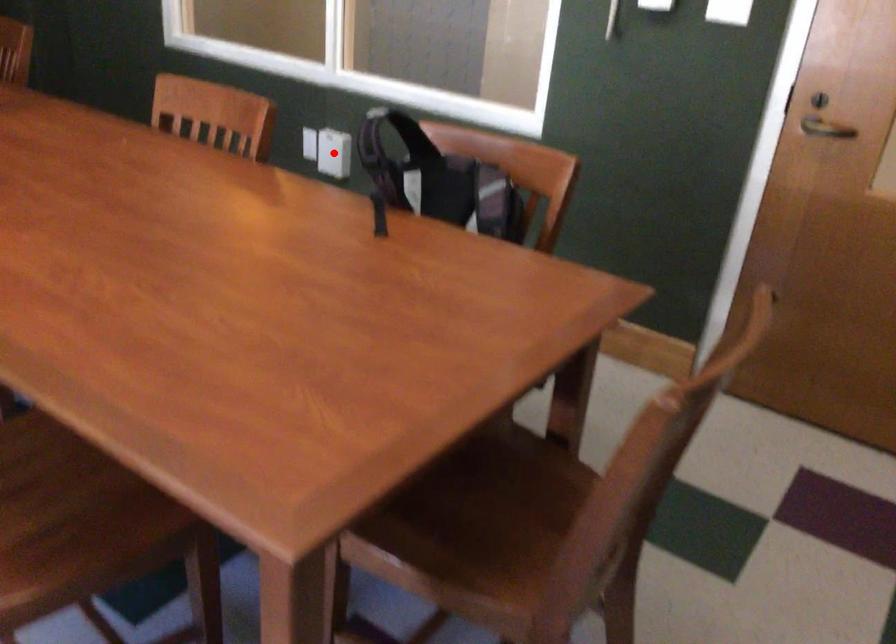
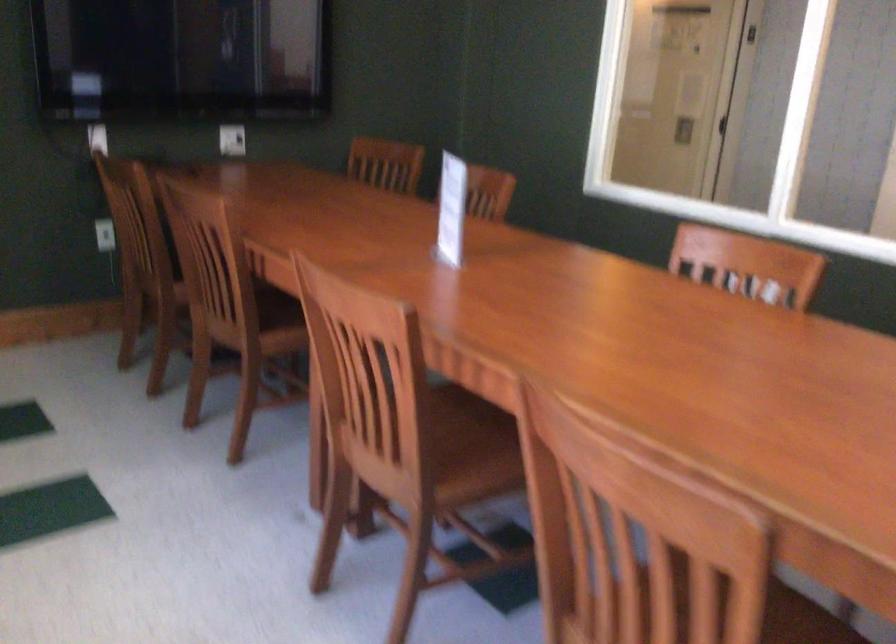
Question: I am providing you with two images of the same scene from different viewpoints. A red point is marked on the first image. Is the red point's position out of view in image 2?

Choices:
 (A) Yes
 (B) No

Answer: (A)